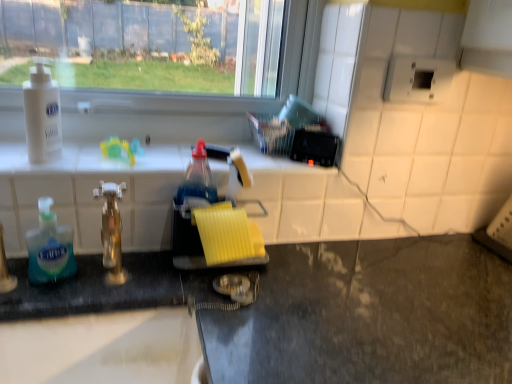
Question: Does translucent plastic soap dispenser at left, arranged as the 1th bottle when ordered from the bottom, have a smaller size compared to white matte lotion at upper left, which ranks as the 2th bottle in bottom-to-top order?

Choices:
 (A) yes
 (B) no

Answer: (A)

Question: Is translucent plastic soap dispenser at left, arranged as the 1th bottle when ordered from the bottom, placed right next to white matte lotion at upper left, which ranks as the 2th bottle in bottom-to-top order?

Choices:
 (A) yes
 (B) no

Answer: (B)

Question: Would you say translucent plastic soap dispenser at left, the 2th bottle positioned from the top, is a long distance from white matte lotion at upper left, which ranks as the 2th bottle in bottom-to-top order?

Choices:
 (A) no
 (B) yes

Answer: (A)

Question: Is translucent plastic soap dispenser at left, arranged as the 1th bottle when ordered from the bottom, bigger than white matte lotion at upper left, which ranks as the 2th bottle in bottom-to-top order?

Choices:
 (A) yes
 (B) no

Answer: (B)

Question: Is translucent plastic soap dispenser at left, arranged as the 1th bottle when ordered from the bottom, surrounding white matte lotion at upper left, arranged as the first bottle when viewed from the top?

Choices:
 (A) yes
 (B) no

Answer: (B)

Question: Is translucent plastic soap dispenser at left, arranged as the 1th bottle when ordered from the bottom, taller than white matte lotion at upper left, arranged as the first bottle when viewed from the top?

Choices:
 (A) yes
 (B) no

Answer: (B)

Question: Can you confirm if white plastic outlet at upper right is bigger than black granite counter at lower left?

Choices:
 (A) yes
 (B) no

Answer: (B)

Question: Is white plastic outlet at upper right to the right of black granite counter at lower left from the viewer's perspective?

Choices:
 (A) yes
 (B) no

Answer: (A)

Question: Is white plastic outlet at upper right further to the viewer compared to black granite counter at lower left?

Choices:
 (A) yes
 (B) no

Answer: (A)

Question: From a real-world perspective, is white plastic outlet at upper right physically below black granite counter at lower left?

Choices:
 (A) no
 (B) yes

Answer: (A)

Question: From a real-world perspective, is white plastic outlet at upper right on black granite counter at lower left?

Choices:
 (A) no
 (B) yes

Answer: (B)

Question: Is white plastic outlet at upper right facing away from black granite counter at lower left?

Choices:
 (A) yes
 (B) no

Answer: (B)

Question: From a real-world perspective, is translucent plastic soap dispenser at left, arranged as the 1th bottle when ordered from the bottom, located higher than gold metallic faucet at center?

Choices:
 (A) yes
 (B) no

Answer: (B)